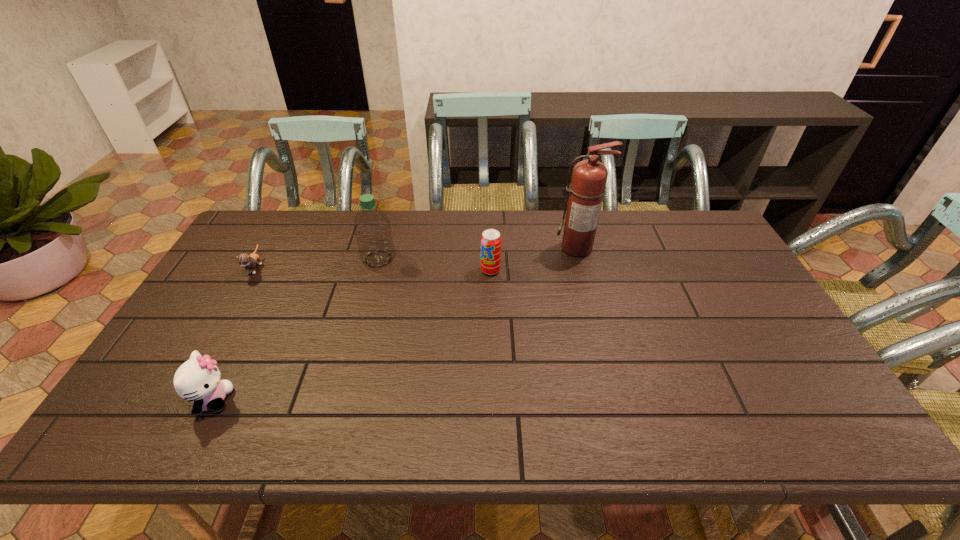
You are a GUI agent. You are given a task and a screenshot of the screen. Output one action in this format:
    pyautogui.click(x=<x>, y=<y>)
    Task: Click on the fire extinguisher
    
    Given the screenshot: What is the action you would take?
    click(x=589, y=177)

Identify the location of the rightmost object. (589, 177).

What are the coordinates of `water bottle` in the screenshot? It's located at (372, 229).

Where is `the third object from right to left`? The height and width of the screenshot is (540, 960). the third object from right to left is located at coordinates (372, 229).

In order to click on the second object from right to left in this screenshot , I will do `click(491, 240)`.

Find the location of `the taller kitten`. the taller kitten is located at coordinates (198, 380).

At what (x,y) coordinates should I click in order to perform the action: click on the right kitten. Please return your answer as a coordinate pair (x, y). This screenshot has height=540, width=960. Looking at the image, I should click on (198, 380).

Where is `the shorter kitten`? the shorter kitten is located at coordinates (249, 262).

Locate an element on the screen. This screenshot has height=540, width=960. the shortest object is located at coordinates (249, 262).

This screenshot has width=960, height=540. I want to click on vacant space located on the front-facing side of the fire extinguisher, so tap(585, 275).